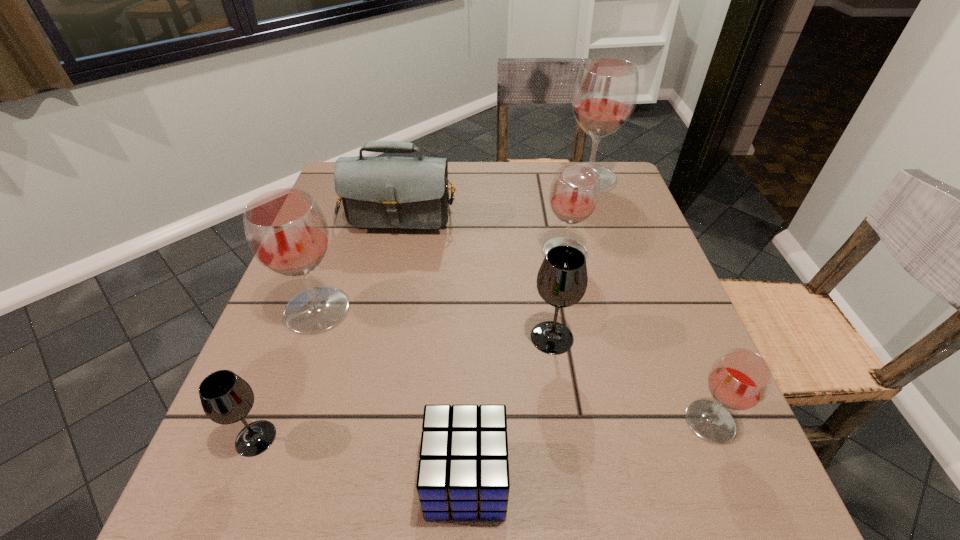
Identify the location of the farthest red wineglass. Image resolution: width=960 pixels, height=540 pixels. (605, 92).

Where is `the tallest object`? This screenshot has height=540, width=960. the tallest object is located at coordinates (605, 92).

Locate an element on the screen. This screenshot has width=960, height=540. the leftmost red wineglass is located at coordinates (286, 231).

This screenshot has height=540, width=960. I want to click on the second tallest object, so click(286, 231).

Locate an element on the screen. The height and width of the screenshot is (540, 960). shoulder bag is located at coordinates (377, 192).

Find the location of a particular element. This screenshot has height=540, width=960. the third biggest red wineglass is located at coordinates (574, 194).

Image resolution: width=960 pixels, height=540 pixels. Find the location of `the fifth nearest wineglass`. the fifth nearest wineglass is located at coordinates (574, 194).

Find the location of a particular element. The height and width of the screenshot is (540, 960). the right gray wineglass is located at coordinates (562, 279).

You are a GUI agent. You are given a task and a screenshot of the screen. Output one action in this format:
    pyautogui.click(x=<x>, y=<y>)
    Task: Click on the bigger gray wineglass
    This screenshot has height=540, width=960.
    Given the screenshot: What is the action you would take?
    pyautogui.click(x=562, y=279)

Find the location of a particular element. Image resolution: width=960 pixels, height=540 pixels. the left gray wineglass is located at coordinates (x=226, y=398).